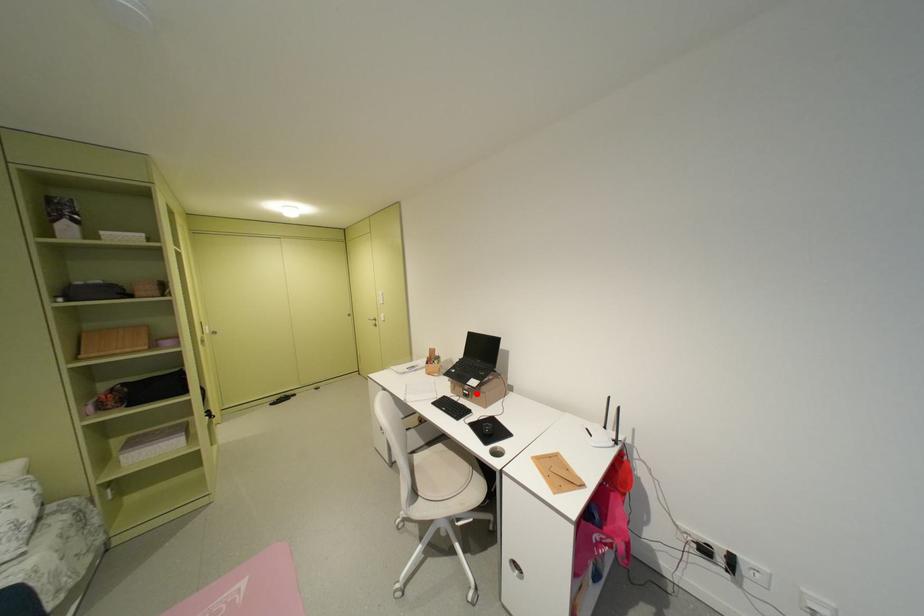
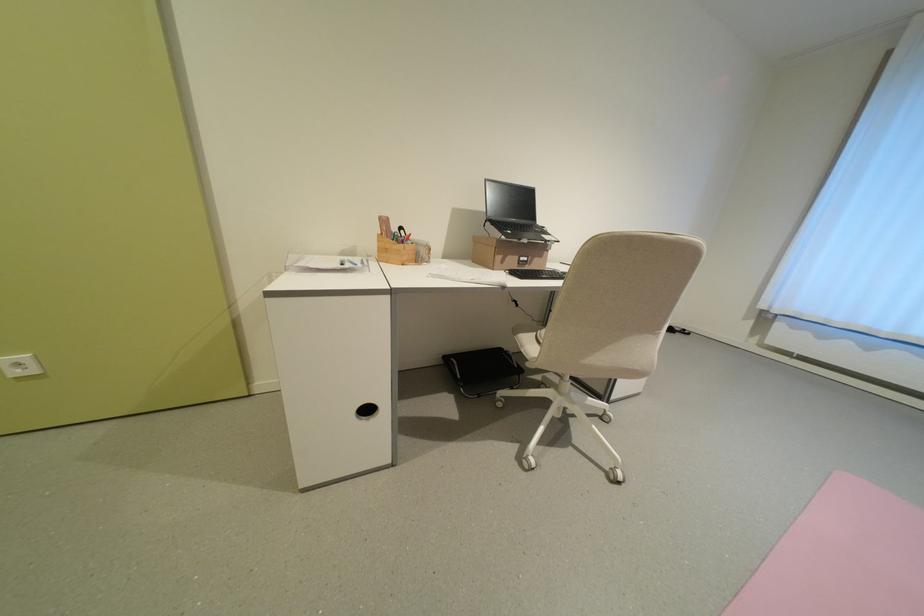
Where in the second image is the point corresponding to the highlighted location from the first image?

(536, 261)